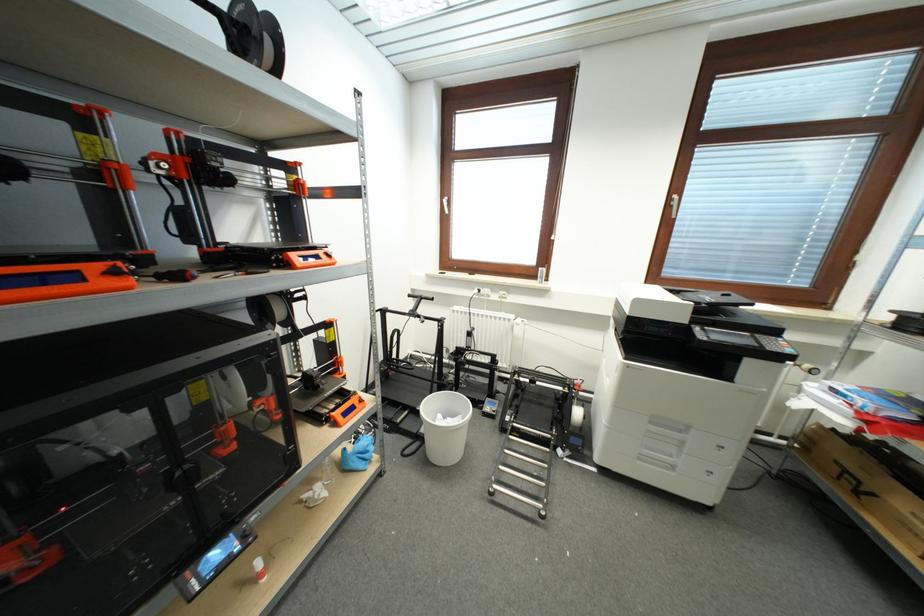
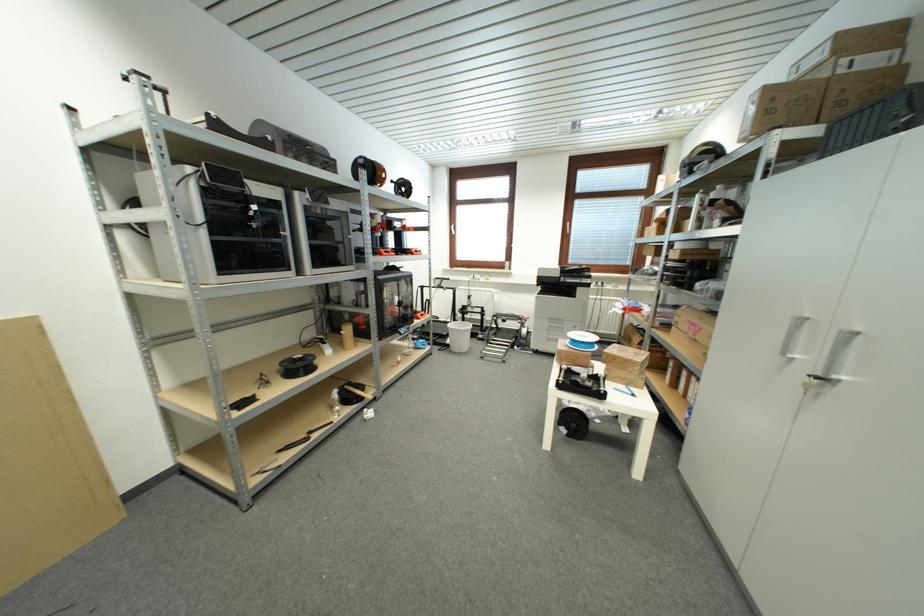
In the second image, find the point that corresponds to pixel 537 384 in the first image.

(507, 323)